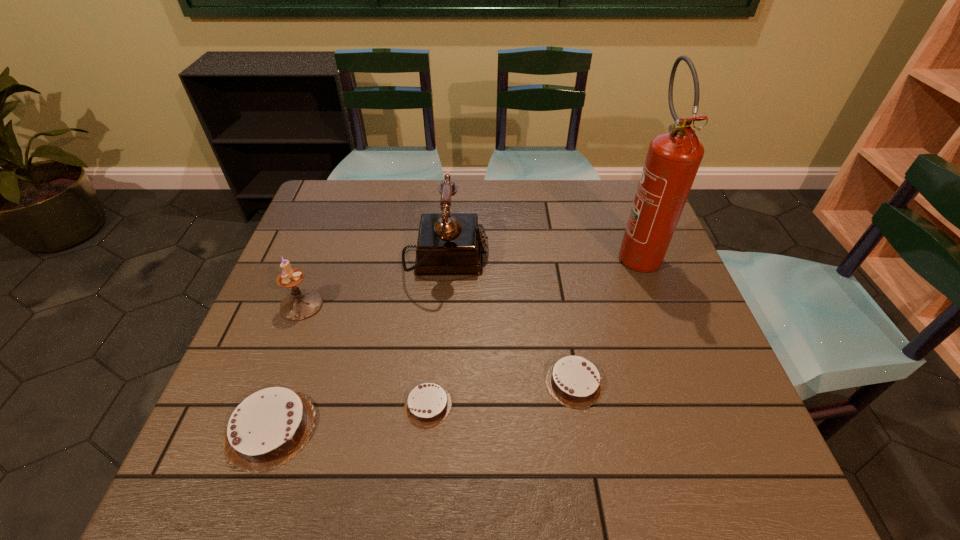
Locate an element on the screen. This screenshot has height=540, width=960. free point that satisfies the following two spatial constraints: 1. on the dial of the fifth object from left to right; 2. on the right side of the second tallest object is located at coordinates (436, 382).

Find the location of `vacant area in the image that satisfies the following two spatial constraints: 1. on the dial of the second shortest chocolate cake; 2. on the left side of the fifth shortest object`. vacant area in the image that satisfies the following two spatial constraints: 1. on the dial of the second shortest chocolate cake; 2. on the left side of the fifth shortest object is located at coordinates (436, 382).

This screenshot has width=960, height=540. What are the coordinates of `free location that satisfies the following two spatial constraints: 1. on the back side of the shortest chocolate cake; 2. on the left side of the rightmost chocolate cake` in the screenshot? It's located at (430, 382).

This screenshot has height=540, width=960. Identify the location of free space that satisfies the following two spatial constraints: 1. on the back side of the leftmost chocolate cake; 2. on the right side of the fifth tallest object. (286, 382).

Find the location of `free space that satisfies the following two spatial constraints: 1. on the back side of the fifth object from left to right; 2. on the right side of the second chocolate cake from left to right`. free space that satisfies the following two spatial constraints: 1. on the back side of the fifth object from left to right; 2. on the right side of the second chocolate cake from left to right is located at coordinates (430, 382).